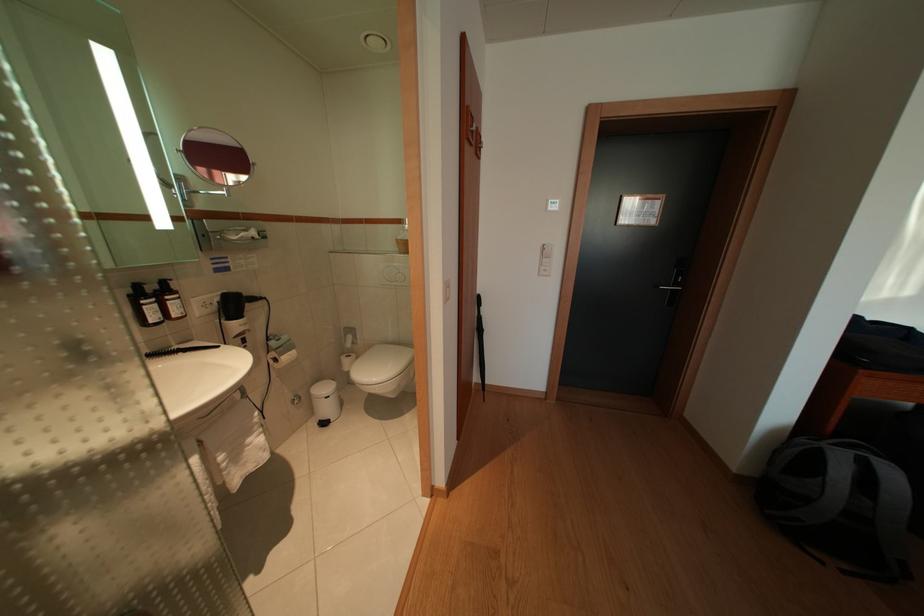
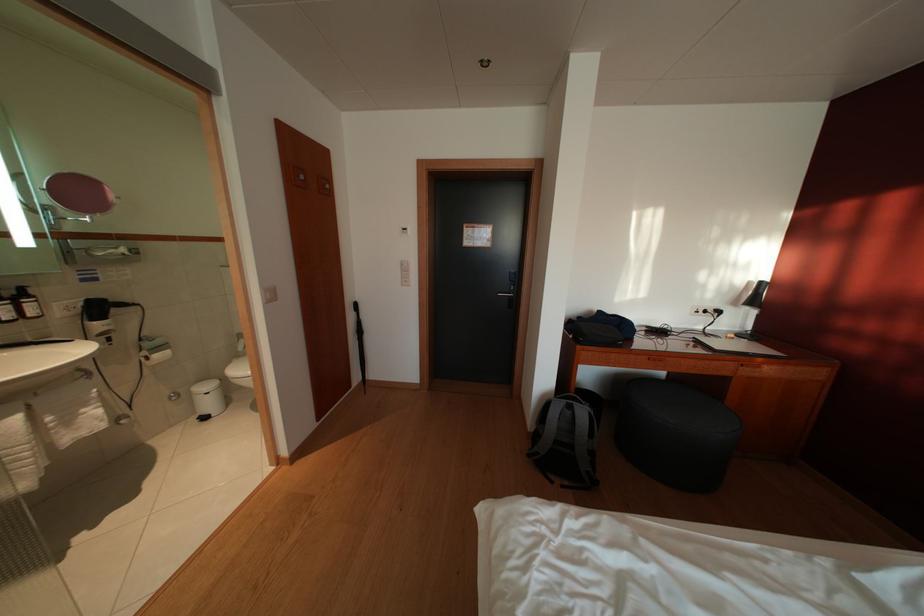
Question: Based on the continuous images, in which direction is the camera rotating? Reply with the corresponding letter.

Choices:
 (A) Left
 (B) Right
 (C) Up
 (D) Down

Answer: (B)